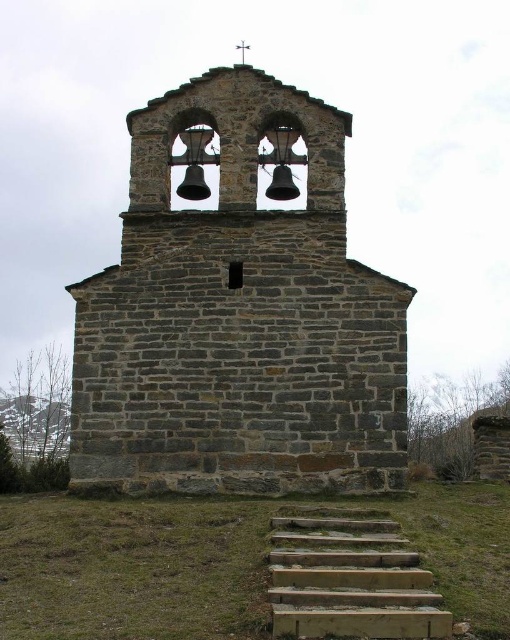
Question: Does green grass at lower center appear on the right side of wooden stairs at lower center?

Choices:
 (A) yes
 (B) no

Answer: (B)

Question: Can you confirm if green grass at lower center is positioned above wooden stairs at lower center?

Choices:
 (A) no
 (B) yes

Answer: (B)

Question: Which object appears farthest from the camera in this image?

Choices:
 (A) gray stone church at center
 (B) wooden stairs at lower center
 (C) green grass at lower center

Answer: (A)

Question: Which of the following is the farthest from the observer?

Choices:
 (A) (22, 566)
 (B) (373, 605)
 (C) (180, 230)

Answer: (C)

Question: Which of these objects is positioned farthest from the gray stone church at center?

Choices:
 (A) green grass at lower center
 (B) wooden stairs at lower center

Answer: (B)

Question: Can you confirm if gray stone church at center is wider than green grass at lower center?

Choices:
 (A) no
 (B) yes

Answer: (A)